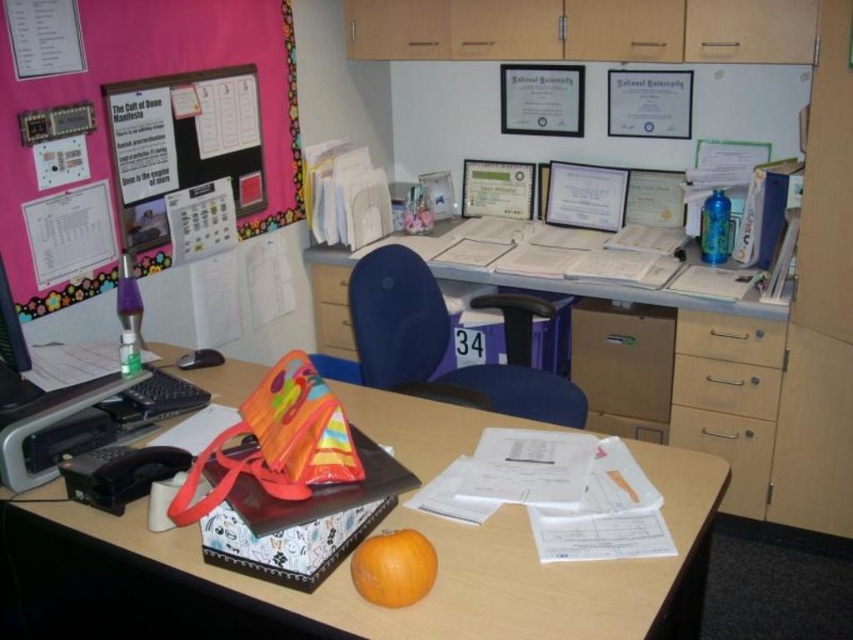
Question: Can you confirm if matte plastic desk at center is thinner than blue fabric swivel chair at center?

Choices:
 (A) yes
 (B) no

Answer: (B)

Question: Which object is farther from the camera taking this photo?

Choices:
 (A) orange matte at center
 (B) wooden drawer at center-right

Answer: (B)

Question: Among these points, which one is nearest to the camera?

Choices:
 (A) (138, 108)
 (B) (370, 538)
 (C) (689, 376)

Answer: (B)

Question: Is black matte bulletin board at upper left to the right of orange matte at center from the viewer's perspective?

Choices:
 (A) yes
 (B) no

Answer: (B)

Question: Can you confirm if blue fabric swivel chair at center is wider than matte black monitor at left?

Choices:
 (A) no
 (B) yes

Answer: (B)

Question: Which point is closer to the camera?

Choices:
 (A) (28, 604)
 (B) (409, 272)
 (C) (677, 362)

Answer: (A)